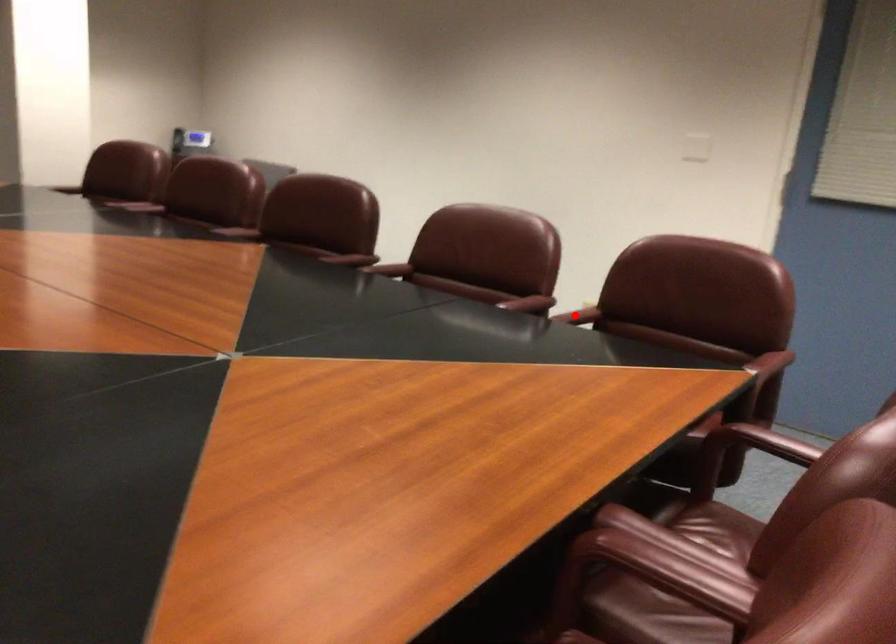
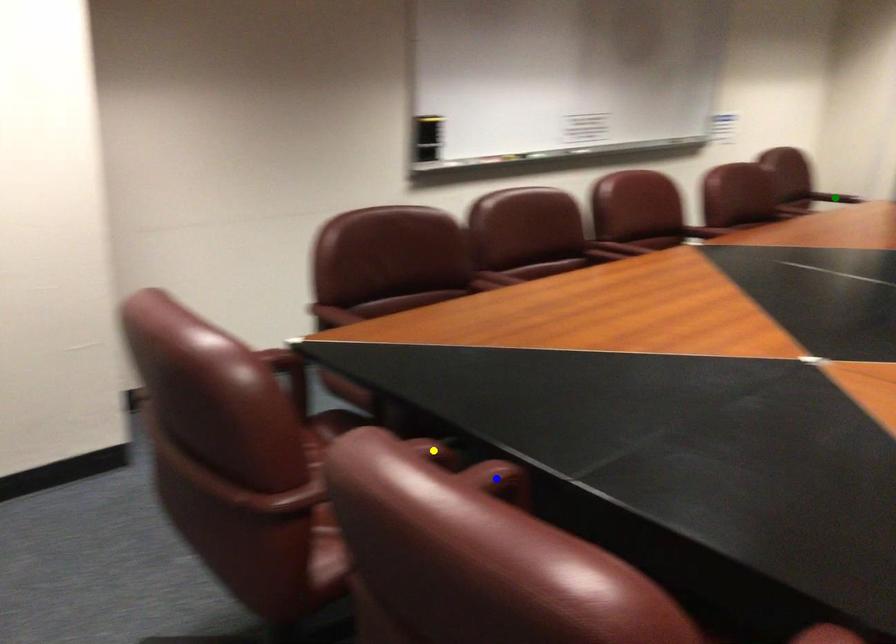
Question: I am providing you with two images of the same scene from different viewpoints. A red point is marked on the first image. You are given multiple points on the second image. Which point in image 2 is actually the same real-world point as the red point in image 1?

Choices:
 (A) green point
 (B) blue point
 (C) yellow point

Answer: (C)